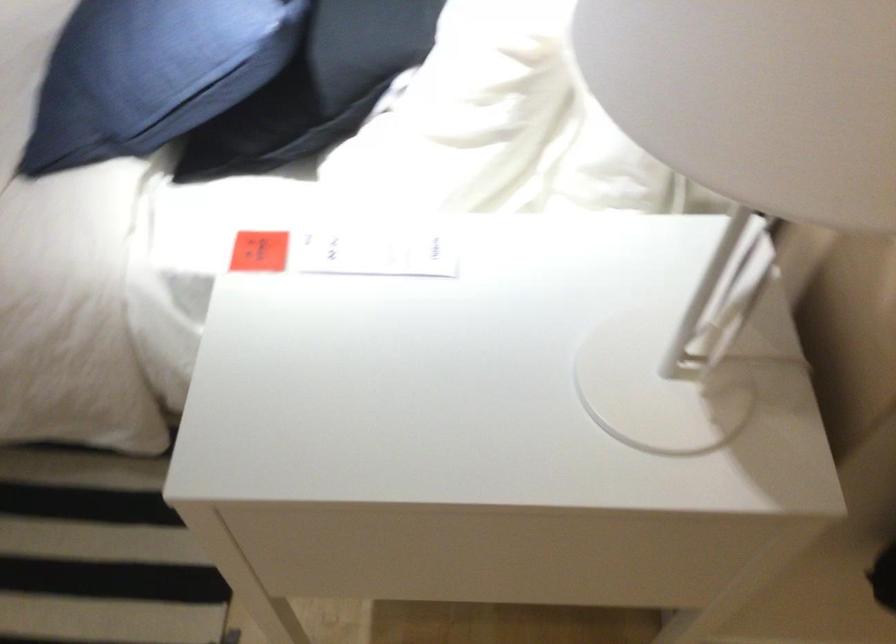
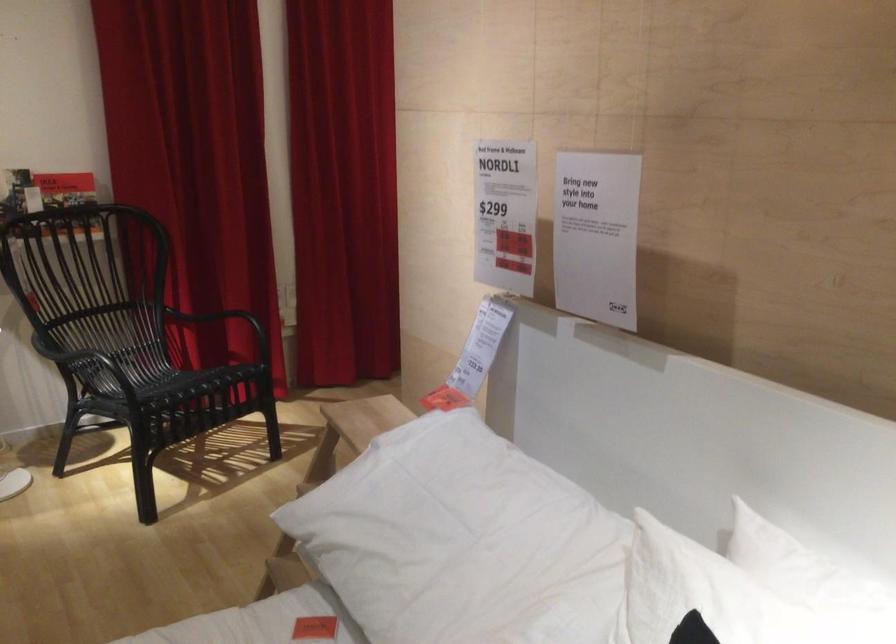
The images are taken continuously from a first-person perspective. In which direction is your viewpoint rotating?

The camera rotated toward right-up.